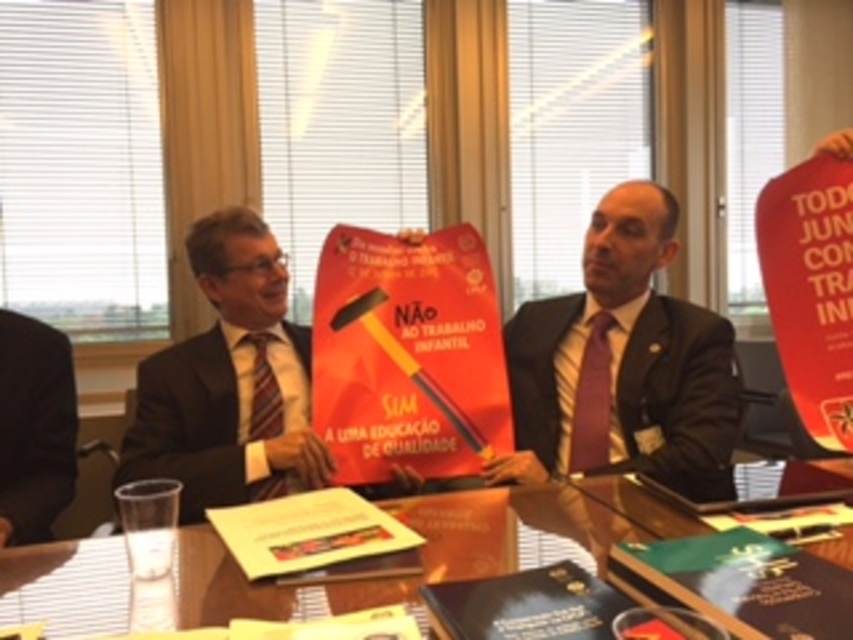
Based on the photo, is glassy clear table at center positioned behind hardcover book at center?

No.

Between point (22, 614) and point (780, 500), which one is positioned in front?

Point (22, 614) is more forward.

Does point (190, 572) lie in front of point (834, 460)?

Yes.

This screenshot has height=640, width=853. What are the coordinates of `glassy clear table at center` in the screenshot? It's located at (486, 536).

Is green matte book at lower right in front of black matte book at center?

No, it is behind black matte book at center.

This screenshot has width=853, height=640. Identify the location of green matte book at lower right. (741, 582).

This screenshot has width=853, height=640. What are the coordinates of `green matte book at lower right` in the screenshot? It's located at (741, 582).

Where is `green matte book at lower right`? This screenshot has height=640, width=853. green matte book at lower right is located at coordinates (741, 582).

Locate an element on the screen. This screenshot has height=640, width=853. matte black suit at center is located at coordinates (619, 358).

Between point (518, 330) and point (752, 588), which one is positioned in front?

Point (752, 588) is in front.

The width and height of the screenshot is (853, 640). What are the coordinates of `matte black suit at center` in the screenshot? It's located at (619, 358).